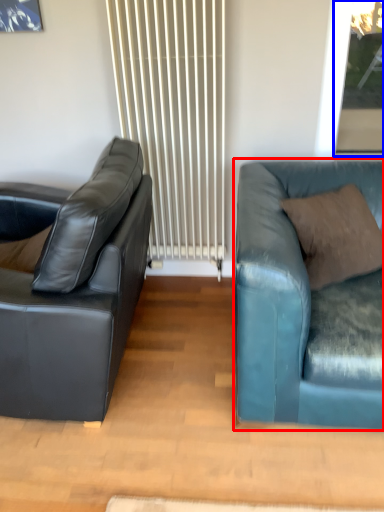
Question: Which object appears farthest to the camera in this image, studio couch (highlighted by a red box) or window screen (highlighted by a blue box)?

Choices:
 (A) studio couch
 (B) window screen

Answer: (B)